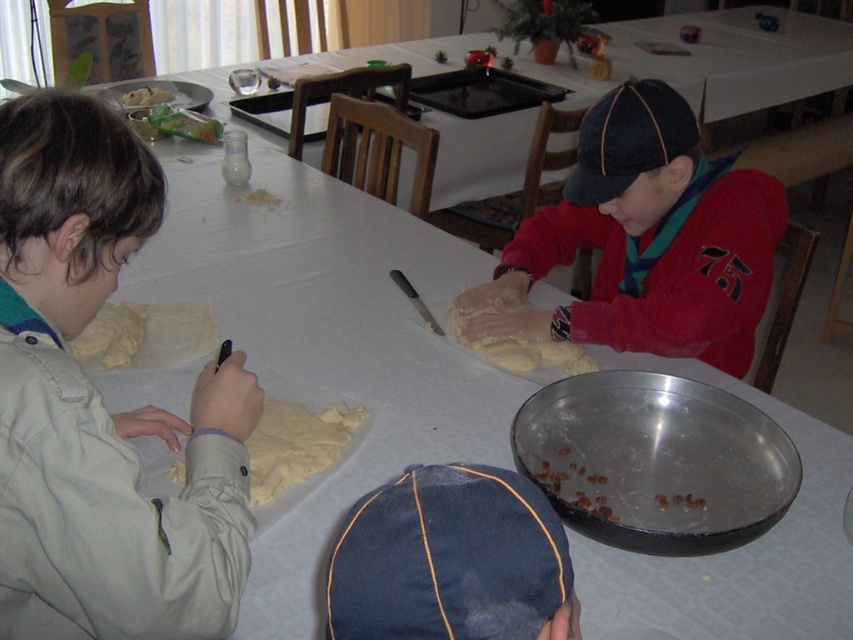
Question: Can you confirm if red fleece sweater at center is wider than white crumbly dough at upper left?

Choices:
 (A) no
 (B) yes

Answer: (B)

Question: Which of the following is the farthest from the observer?

Choices:
 (A) (90, 364)
 (B) (128, 131)
 (C) (363, 621)
 (D) (583, 353)

Answer: (D)

Question: Which is farther from the light beige fabric jacket at left?

Choices:
 (A) yellow dough at left
 (B) denim cap at lower center
 (C) yellowish dough at center

Answer: (C)

Question: Does red fleece sweater at center appear on the left side of denim cap at lower center?

Choices:
 (A) no
 (B) yes

Answer: (A)

Question: Is red fleece sweater at center below white crumbly dough at upper left?

Choices:
 (A) yes
 (B) no

Answer: (A)

Question: Based on their relative distances, which object is farther from the denim cap at lower center?

Choices:
 (A) yellowish dough at center
 (B) yellowish dough at lower left
 (C) light beige fabric jacket at left

Answer: (A)